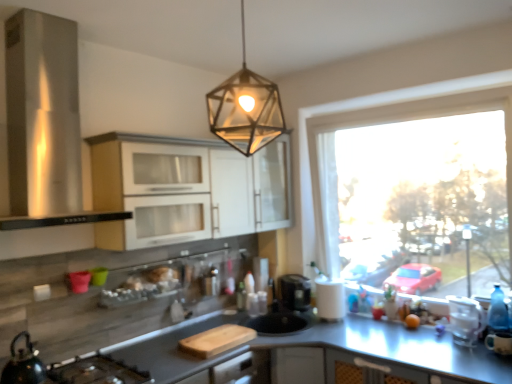
Find the location of a particular element. free space in front of white matte paper towel at right is located at coordinates (345, 328).